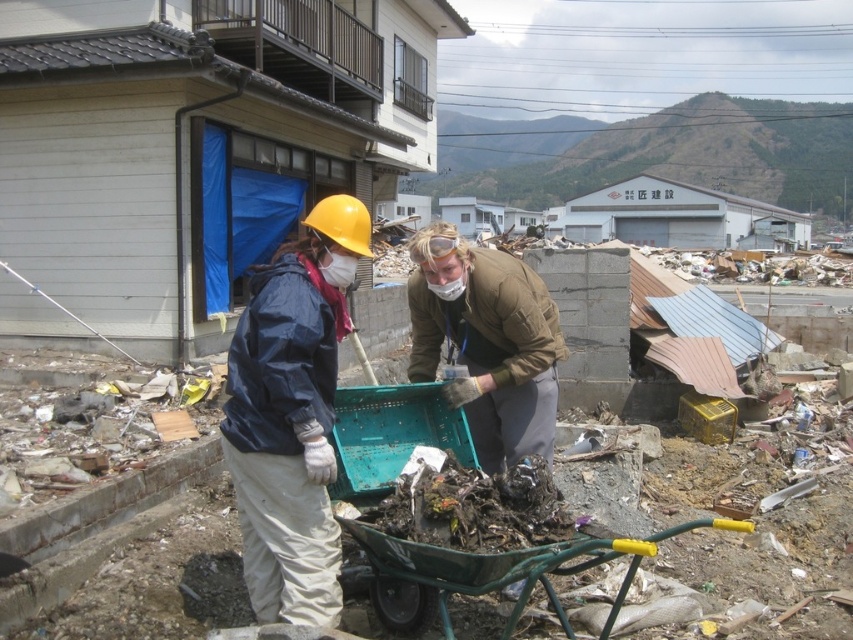
Does matte yellow hard hat at center lie in front of green plastic cart at lower center?

No, it is not.

Image resolution: width=853 pixels, height=640 pixels. What do you see at coordinates (292, 416) in the screenshot? I see `matte yellow hard hat at center` at bounding box center [292, 416].

Does point (264, 481) come closer to viewer compared to point (415, 593)?

Yes, it is in front of point (415, 593).

This screenshot has height=640, width=853. I want to click on matte yellow hard hat at center, so click(292, 416).

Does matte blue jacket at center appear on the right side of matte yellow hard hat at center?

Correct, you'll find matte blue jacket at center to the right of matte yellow hard hat at center.

Can you confirm if matte blue jacket at center is positioned to the left of matte yellow hard hat at center?

Incorrect, matte blue jacket at center is not on the left side of matte yellow hard hat at center.

Locate an element on the screen. The image size is (853, 640). matte blue jacket at center is located at coordinates 292,416.

At what (x,y) coordinates should I click in order to perform the action: click on matte blue jacket at center. Please return your answer as a coordinate pair (x, y). Image resolution: width=853 pixels, height=640 pixels. Looking at the image, I should click on (292, 416).

Is point (492, 461) farther from viewer compared to point (384, 605)?

That is True.

Can you confirm if brown leather jacket at center is shorter than green plastic cart at lower center?

Indeed, brown leather jacket at center has a lesser height compared to green plastic cart at lower center.

This screenshot has width=853, height=640. I want to click on brown leather jacket at center, so tap(486, 340).

Where is `brown leather jacket at center`? This screenshot has width=853, height=640. brown leather jacket at center is located at coordinates (486, 340).